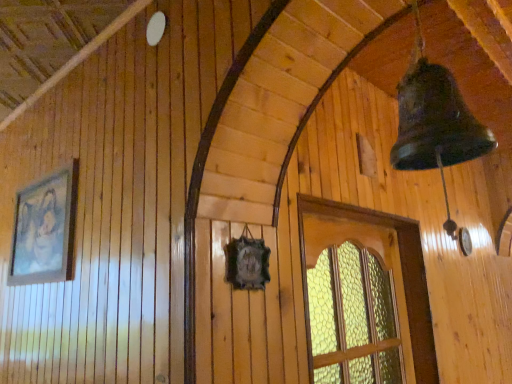
The image size is (512, 384). I want to click on translucent glass window at center, so click(x=364, y=296).

Describe the element at coordinates (364, 296) in the screenshot. I see `translucent glass window at center` at that location.

Image resolution: width=512 pixels, height=384 pixels. Describe the element at coordinates (45, 229) in the screenshot. I see `matte wooden picture frame at left` at that location.

What are the coordinates of `matte wooden picture frame at left` in the screenshot? It's located at (45, 229).

You are a GUI agent. You are given a task and a screenshot of the screen. Output one action in this format:
    pyautogui.click(x=<x>, y=<y>)
    Task: Click on the translucent glass window at center
    
    Given the screenshot: What is the action you would take?
    pyautogui.click(x=364, y=296)

Looking at this image, which object is positioned more to the left, matte wooden picture frame at left or translucent glass window at center?

From the viewer's perspective, matte wooden picture frame at left appears more on the left side.

Is the position of matte wooden picture frame at left less distant than that of translucent glass window at center?

No, matte wooden picture frame at left is further to the viewer.

Does point (19, 265) come in front of point (424, 378)?

Yes, it is in front of point (424, 378).

From the image's perspective, is matte wooden picture frame at left positioned above or below translucent glass window at center?

Based on their image positions, matte wooden picture frame at left is located above translucent glass window at center.

From a real-world perspective, which object rests below the other?

From a 3D spatial view, translucent glass window at center is below.

Does matte wooden picture frame at left have a greater width compared to translucent glass window at center?

In fact, matte wooden picture frame at left might be narrower than translucent glass window at center.

Who is taller, matte wooden picture frame at left or translucent glass window at center?

Standing taller between the two is translucent glass window at center.

Who is smaller, matte wooden picture frame at left or translucent glass window at center?

matte wooden picture frame at left is smaller.

Is matte wooden picture frame at left located outside translucent glass window at center?

Absolutely, matte wooden picture frame at left is external to translucent glass window at center.

Are matte wooden picture frame at left and translucent glass window at center located far from each other?

Yes, matte wooden picture frame at left and translucent glass window at center are quite far apart.

Is matte wooden picture frame at left turned away from translucent glass window at center?

No.

Can you tell me how much matte wooden picture frame at left and translucent glass window at center differ in facing direction?

matte wooden picture frame at left and translucent glass window at center are facing 88.7 degrees away from each other.

You are a GUI agent. You are given a task and a screenshot of the screen. Output one action in this format:
    pyautogui.click(x=<x>, y=<y>)
    Task: Click on the picture frame above the translucent glass window at center (from a real-world perspective)
    The height and width of the screenshot is (384, 512).
    Given the screenshot: What is the action you would take?
    pyautogui.click(x=45, y=229)

In the image, is translucent glass window at center on the left side or the right side of matte wooden picture frame at left?

translucent glass window at center is to the right of matte wooden picture frame at left.

Does translucent glass window at center come behind matte wooden picture frame at left?

No, translucent glass window at center is closer to the viewer.

Considering the points (390, 249) and (42, 238), which point is in front, point (390, 249) or point (42, 238)?

Point (42, 238)

From the image's perspective, is translucent glass window at center below matte wooden picture frame at left?

Yes, from the image's perspective, translucent glass window at center is beneath matte wooden picture frame at left.

Consider the image. From a real-world perspective, is translucent glass window at center positioned under matte wooden picture frame at left based on gravity?

Yes, from a real-world perspective, translucent glass window at center is under matte wooden picture frame at left.

Which of these two, translucent glass window at center or matte wooden picture frame at left, is thinner?

With smaller width is matte wooden picture frame at left.

Which of these two, translucent glass window at center or matte wooden picture frame at left, stands shorter?

matte wooden picture frame at left.

Who is bigger, translucent glass window at center or matte wooden picture frame at left?

Bigger between the two is translucent glass window at center.

Would you say translucent glass window at center contains matte wooden picture frame at left?

No, matte wooden picture frame at left is located outside of translucent glass window at center.

Is translucent glass window at center touching matte wooden picture frame at left?

There is a gap between translucent glass window at center and matte wooden picture frame at left.

Is translucent glass window at center turned away from matte wooden picture frame at left?

translucent glass window at center does not have its back to matte wooden picture frame at left.

How different are the orientations of translucent glass window at center and matte wooden picture frame at left in degrees?

translucent glass window at center and matte wooden picture frame at left are facing 88.7 degrees away from each other.

Find the location of a particular element. picture frame behind the translucent glass window at center is located at coordinates (45, 229).

Find the location of a particular element. picture frame above the translucent glass window at center (from a real-world perspective) is located at coordinates (45, 229).

You are a GUI agent. You are given a task and a screenshot of the screen. Output one action in this format:
    pyautogui.click(x=<x>, y=<y>)
    Task: Click on the picture frame on the left side of translucent glass window at center
    The image size is (512, 384).
    Given the screenshot: What is the action you would take?
    pyautogui.click(x=45, y=229)